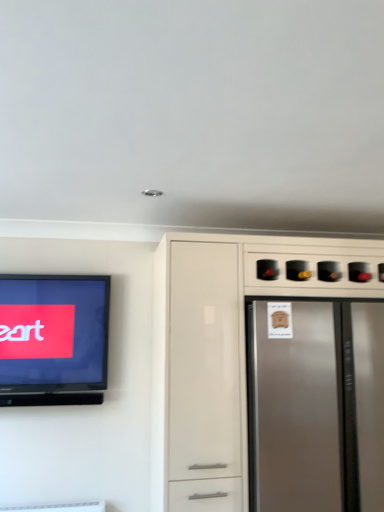
I want to click on satin white cabinet at right, so click(x=241, y=356).

Which is nearer, [341,402] or [56,316]?

Point [341,402] is positioned closer to the camera compared to point [56,316].

Is satin silver refrigerator at right smaller than matte black television at left?

Actually, satin silver refrigerator at right might be larger than matte black television at left.

Image resolution: width=384 pixels, height=512 pixels. I want to click on television on the left of satin silver refrigerator at right, so click(x=53, y=339).

Measure the distance from satin silver refrigerator at right to matte black television at left.

A distance of 3.54 feet exists between satin silver refrigerator at right and matte black television at left.

From a real-world perspective, relative to satin white cabinet at right, is satin silver refrigerator at right vertically above or below?

From a real-world perspective, satin silver refrigerator at right is physically below satin white cabinet at right.

Is satin silver refrigerator at right in front of satin white cabinet at right?

No.

What's the angular difference between satin silver refrigerator at right and satin white cabinet at right's facing directions?

2.21 degrees separate the facing orientations of satin silver refrigerator at right and satin white cabinet at right.

The image size is (384, 512). Find the location of `refrigerator directly beneath the satin white cabinet at right (from a real-world perspective)`. refrigerator directly beneath the satin white cabinet at right (from a real-world perspective) is located at coordinates (304, 411).

How many degrees apart are the facing directions of matte black television at left and satin silver refrigerator at right?

2.68 degrees separate the facing orientations of matte black television at left and satin silver refrigerator at right.

Does matte black television at left contain satin silver refrigerator at right?

No, satin silver refrigerator at right is located outside of matte black television at left.

Is matte black television at left next to satin silver refrigerator at right and touching it?

No, matte black television at left is not beside satin silver refrigerator at right.

Is matte black television at left positioned before satin silver refrigerator at right?

No, matte black television at left is further to the viewer.

Considering the relative positions of satin white cabinet at right and matte black television at left in the image provided, is satin white cabinet at right in front of matte black television at left?

Yes.

Is satin white cabinet at right far away from matte black television at left?

Actually, satin white cabinet at right and matte black television at left are a little close together.

Which is correct: satin white cabinet at right is inside matte black television at left, or outside of it?

satin white cabinet at right exists outside the volume of matte black television at left.

Between satin white cabinet at right and matte black television at left, which one has more height?

satin white cabinet at right.

From a real-world perspective, is matte black television at left located beneath satin white cabinet at right?

No, from a real-world perspective, matte black television at left is not under satin white cabinet at right.

Between matte black television at left and satin white cabinet at right, which one has larger size?

satin white cabinet at right is bigger.

In the scene shown: Is matte black television at left taller or shorter than satin white cabinet at right?

Considering their sizes, matte black television at left has less height than satin white cabinet at right.

Is matte black television at left next to satin white cabinet at right and touching it?

No.

How different are the orientations of satin white cabinet at right and satin silver refrigerator at right in degrees?

The angle between the facing direction of satin white cabinet at right and the facing direction of satin silver refrigerator at right is 2.21 degrees.

From the image's perspective, which object appears higher, satin white cabinet at right or satin silver refrigerator at right?

From the image's view, satin white cabinet at right is above.

This screenshot has width=384, height=512. I want to click on refrigerator that is under the satin white cabinet at right (from a real-world perspective), so click(304, 411).

You are a GUI agent. You are given a task and a screenshot of the screen. Output one action in this format:
    pyautogui.click(x=<x>, y=<y>)
    Task: Click on the refrigerator lying below the matte black television at left (from the image's perspective)
    This screenshot has width=384, height=512.
    Given the screenshot: What is the action you would take?
    pyautogui.click(x=304, y=411)

Image resolution: width=384 pixels, height=512 pixels. In the image, there is a satin white cabinet at right. Identify the location of refrigerator below it (from a real-world perspective). (304, 411).

Looking at this image, which object lies further to the anchor point matte black television at left, satin silver refrigerator at right or satin white cabinet at right?

Based on the image, satin silver refrigerator at right appears to be further to matte black television at left.

Looking at the image, which one is located further to satin silver refrigerator at right, matte black television at left or satin white cabinet at right?

Among the two, matte black television at left is located further to satin silver refrigerator at right.

Estimate the real-world distances between objects in this image. Which object is closer to matte black television at left, satin white cabinet at right or satin silver refrigerator at right?

The object closer to matte black television at left is satin white cabinet at right.

When comparing their distances from satin silver refrigerator at right, does satin white cabinet at right or matte black television at left seem closer?

satin white cabinet at right is positioned closer to the anchor satin silver refrigerator at right.

In the scene shown: Looking at the image, which one is located closer to satin white cabinet at right, matte black television at left or satin silver refrigerator at right?

satin silver refrigerator at right lies closer to satin white cabinet at right than the other object.

From the image, which object appears to be nearer to satin white cabinet at right, satin silver refrigerator at right or matte black television at left?

Among the two, satin silver refrigerator at right is located nearer to satin white cabinet at right.

The image size is (384, 512). Find the location of `cabinetry between matte black television at left and satin silver refrigerator at right from left to right`. cabinetry between matte black television at left and satin silver refrigerator at right from left to right is located at coordinates (241, 356).